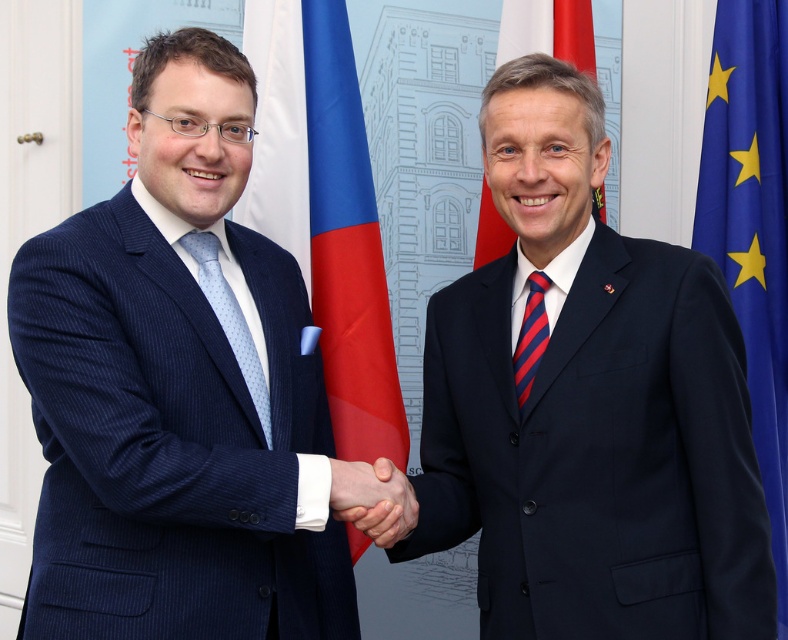
Question: Among these objects, which one is farthest from the camera?

Choices:
 (A) dark blue suit at center
 (B) polished wood flag at upper center

Answer: (B)

Question: Which of the following is the closest to the observer?

Choices:
 (A) polished wood flag at upper center
 (B) blue fabric flag at right

Answer: (B)

Question: Is dark blue suit at center wider than smooth skin hand at center?

Choices:
 (A) no
 (B) yes

Answer: (B)

Question: Considering the relative positions of dark blue suit at center and smooth skin hand at center in the image provided, where is dark blue suit at center located with respect to smooth skin hand at center?

Choices:
 (A) left
 (B) right

Answer: (B)

Question: Does smooth skin hand at center have a larger size compared to light blue dotted tie at center?

Choices:
 (A) no
 (B) yes

Answer: (A)

Question: Which point appears closest to the camera in this image?

Choices:
 (A) (560, 550)
 (B) (91, 440)
 (C) (296, 67)
 (D) (214, 275)

Answer: (B)